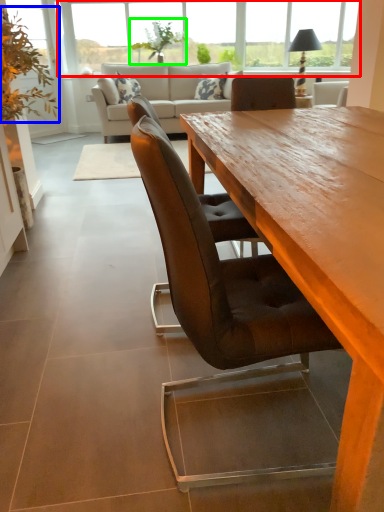
Question: Which object is positioned closest to window (highlighted by a red box)? Select from plant (highlighted by a blue box) and plant (highlighted by a green box).

Choices:
 (A) plant
 (B) plant

Answer: (B)